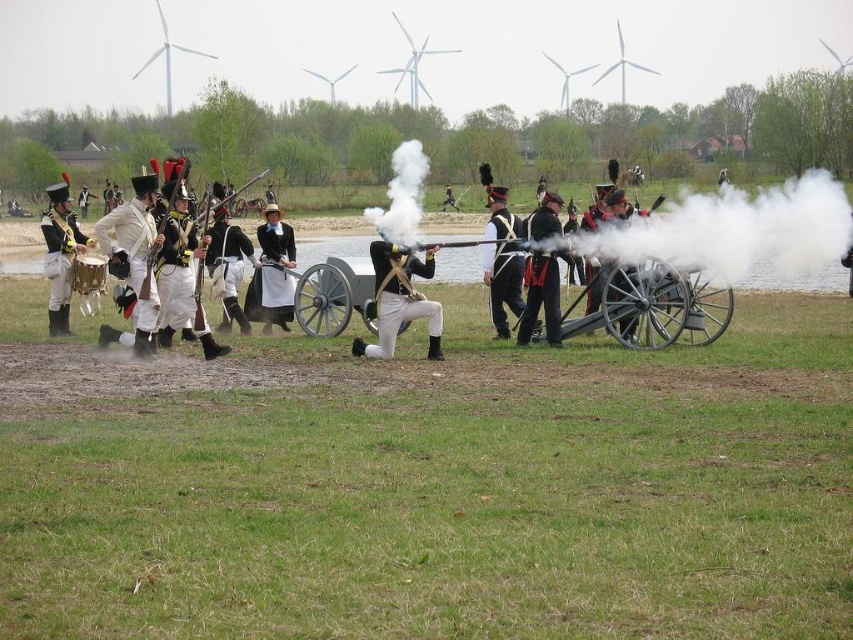
You are a photographer standing at the camera position capturing this historical reenactment scene. You want to ensure that the point at coordinates point (167,188) is in focus. If your camera has a depth of field that can sharply focus objects within 15 meters to 18 meters, will this point be in focus?

The distance of point (167,188) from the camera is 17.12 meters, which falls within the depth of field range of 15 meters to 18 meters. Therefore, the point will be in focus.

You are a photographer capturing this historical reenactment scene. You need to focus your camera on the white cotton uniform at left and the matte black dress at center. Which one should you adjust your focus settings for first to ensure it appears sharp in the final photo?

The white cotton uniform at left is closer to the viewer than the matte black dress at center, so you should focus on the white cotton uniform at left first. Since it is nearer, adjusting focus starting from the closer object ensures both can be in focus if the depth of field is sufficient.

Looking at this image, you are a photographer at the historical reenactment event. You want to capture a photo that includes both the shiny black uniform at center and the white cotton uniform at center. Can you position yourself so that neither uniform blocks the other in the photo?

The shiny black uniform at center is in front of the white cotton uniform at center, so positioning yourself behind both uniforms would ensure neither blocks the other. Alternatively, moving to the side might allow both to be visible without obstruction.